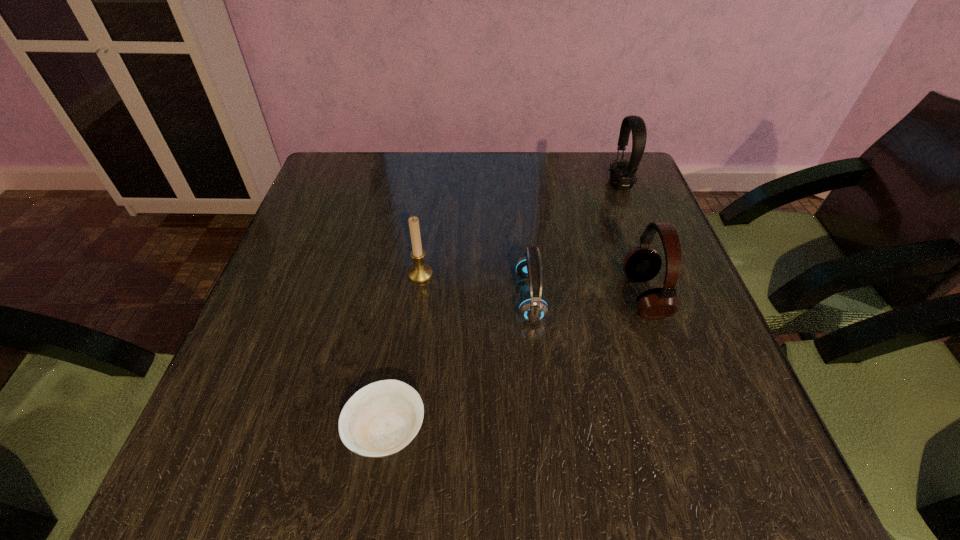
The image size is (960, 540). I want to click on the farthest object, so click(622, 173).

The height and width of the screenshot is (540, 960). Identify the location of candle holder. (419, 273).

Image resolution: width=960 pixels, height=540 pixels. What are the coordinates of `the fourth tallest object` in the screenshot? It's located at (533, 309).

Find the location of a particular element. the third object from left to right is located at coordinates (533, 309).

Where is `the nearest object`? Image resolution: width=960 pixels, height=540 pixels. the nearest object is located at coordinates (381, 419).

Where is `the shortest object`? Image resolution: width=960 pixels, height=540 pixels. the shortest object is located at coordinates (381, 419).

At what (x,y) coordinates should I click in order to perform the action: click on vacant space located on the front-facing side of the farthest object. Please return your answer as a coordinate pair (x, y). The height and width of the screenshot is (540, 960). Looking at the image, I should click on (474, 184).

Where is `free location located 0.110m on the front-facing side of the farthest object`? This screenshot has width=960, height=540. free location located 0.110m on the front-facing side of the farthest object is located at coordinates (568, 184).

Where is `vacant space located 0.300m on the front-facing side of the farthest object`? The image size is (960, 540). vacant space located 0.300m on the front-facing side of the farthest object is located at coordinates (497, 184).

Identify the location of vacant region located 0.070m on the back of the candle holder. (424, 245).